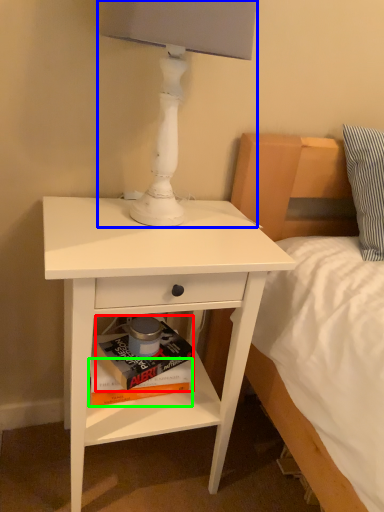
Question: Based on their relative distances, which object is nearer to paperback book (highlighted by a red box)? Choose from table lamp (highlighted by a blue box) and paperback book (highlighted by a green box).

Choices:
 (A) table lamp
 (B) paperback book

Answer: (B)